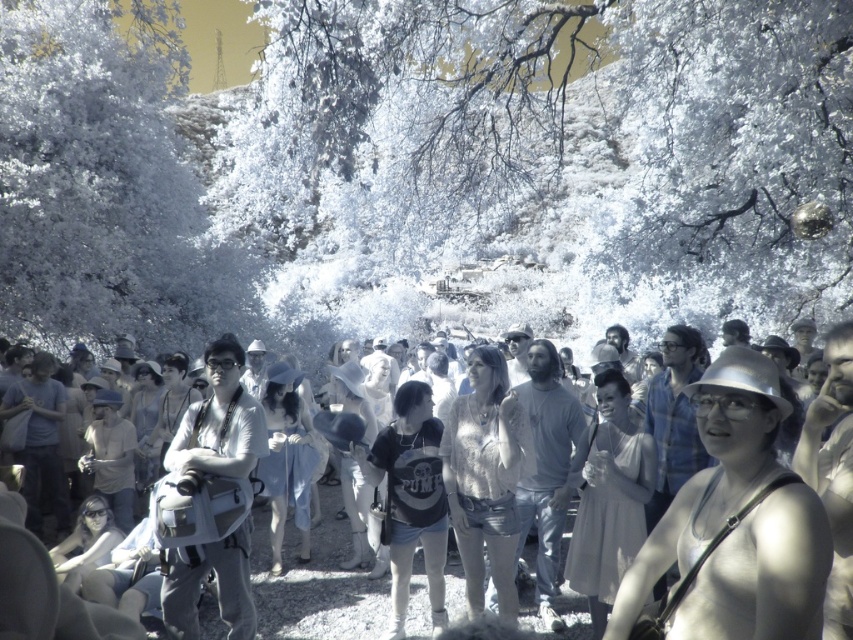
Which is more to the left, matte white shirt at center or metallic silver hat at center?

From the viewer's perspective, matte white shirt at center appears more on the left side.

Can you confirm if matte white shirt at center is wider than metallic silver hat at center?

Indeed, matte white shirt at center has a greater width compared to metallic silver hat at center.

Is point (511, 572) more distant than point (738, 531)?

Yes, it is.

Locate an element on the screen. The width and height of the screenshot is (853, 640). matte white shirt at center is located at coordinates (735, 524).

Does white frosty tree at upper center appear on the left side of matte black t-shirt at center?

No, white frosty tree at upper center is not to the left of matte black t-shirt at center.

Is point (662, 294) positioned after point (410, 560)?

Yes, it is behind point (410, 560).

You are a GUI agent. You are given a task and a screenshot of the screen. Output one action in this format:
    pyautogui.click(x=<x>, y=<y>)
    Task: Click on the white frosty tree at upper center
    Image resolution: width=853 pixels, height=640 pixels.
    Given the screenshot: What is the action you would take?
    pyautogui.click(x=567, y=138)

Is matte gray backpack at center positioned before matte black t-shirt at center?

Yes, matte gray backpack at center is in front of matte black t-shirt at center.

Is point (222, 342) farther from viewer compared to point (428, 474)?

Yes, it is behind point (428, 474).

Locate an element on the screen. The height and width of the screenshot is (640, 853). matte gray backpack at center is located at coordinates (x=219, y=420).

Identify the location of matte gray backpack at center. (219, 420).